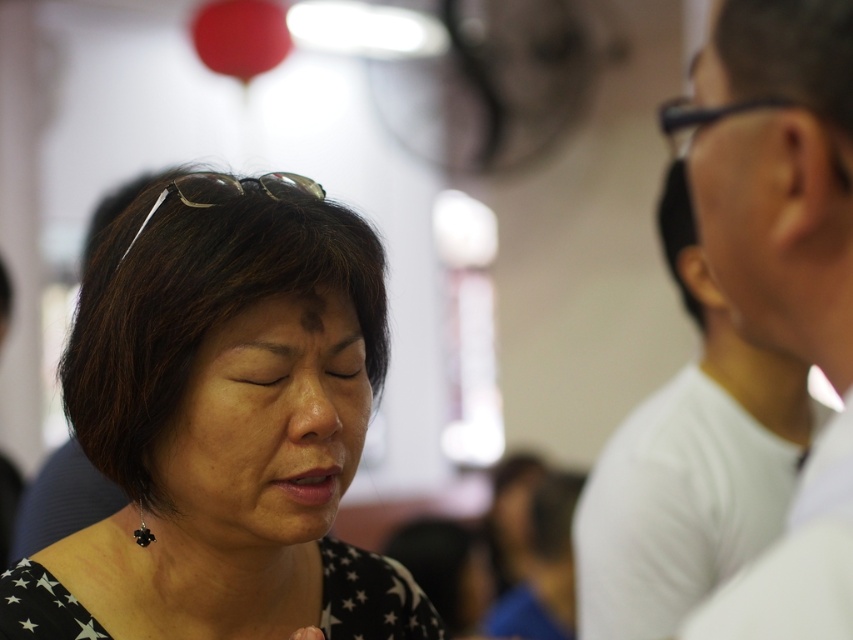
Between black matte/soft fabric at center and matte white face at right, which one has more height?

Standing taller between the two is black matte/soft fabric at center.

Describe the element at coordinates (222, 424) in the screenshot. I see `black matte/soft fabric at center` at that location.

Which is behind, point (165, 237) or point (714, 193)?

Point (165, 237)

At what (x,y) coordinates should I click in order to perform the action: click on black matte/soft fabric at center. Please return your answer as a coordinate pair (x, y). Looking at the image, I should click on (222, 424).

Does smooth skin face at center appear under matte white face at right?

Yes, smooth skin face at center is below matte white face at right.

Is point (238, 412) closer to viewer compared to point (784, 150)?

No, (238, 412) is further to viewer.

Find the location of a particular element. smooth skin face at center is located at coordinates (264, 428).

Does black matte/soft fabric at center appear under smooth skin face at center?

No.

Between point (22, 611) and point (323, 516), which one is positioned behind?

Positioned behind is point (22, 611).

Who is more forward, (195, 625) or (254, 465)?

Point (254, 465) is more forward.

Locate an element on the screen. This screenshot has height=640, width=853. black matte/soft fabric at center is located at coordinates (222, 424).